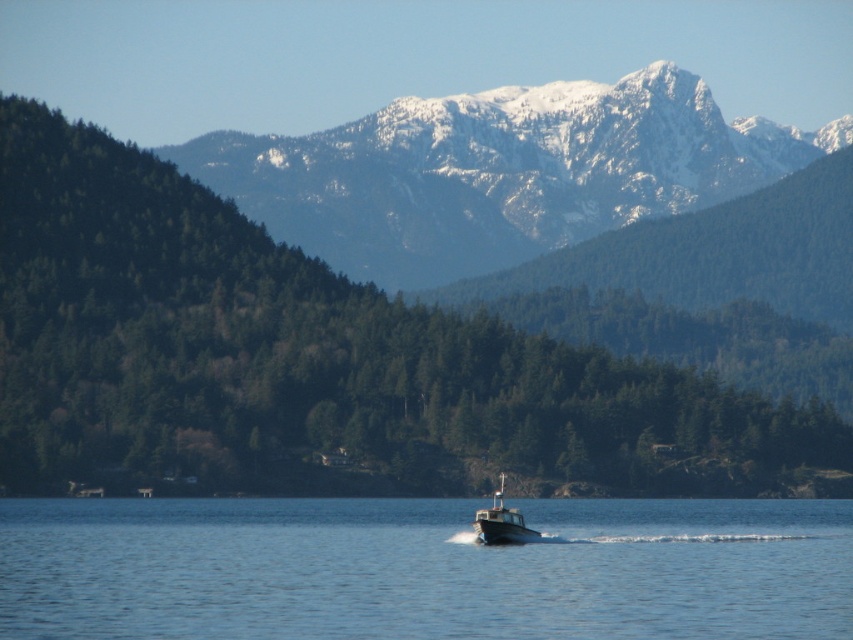
Question: Which object is positioned closest to the white plastic boat at center?

Choices:
 (A) snowy rocky mountain range at upper center
 (B) blue water at center
 (C) green matte tree at center

Answer: (B)

Question: Does green matte tree at center have a greater width compared to blue water at center?

Choices:
 (A) no
 (B) yes

Answer: (B)

Question: Can you confirm if blue water at center is bigger than snowy rocky mountain range at upper center?

Choices:
 (A) yes
 (B) no

Answer: (B)

Question: Which point is closer to the camera?

Choices:
 (A) snowy rocky mountain range at upper center
 (B) white plastic boat at center
 (C) green matte tree at center

Answer: (B)

Question: Considering the real-world distances, which object is farthest from the blue water at center?

Choices:
 (A) white plastic boat at center
 (B) green matte tree at center

Answer: (A)

Question: From the image, what is the correct spatial relationship of green matte tree at center in relation to blue water at center?

Choices:
 (A) below
 (B) above

Answer: (B)